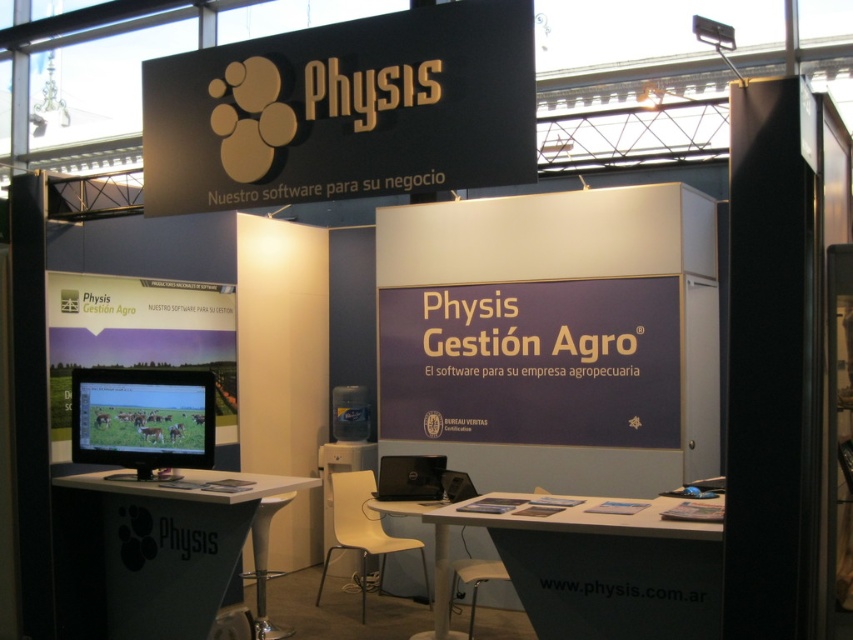
You are a visitor at the trade show and want to sit down to discuss the software with a representative. There is a white matte table at center and a white plastic stool at lower center. Which object should you approach to sit comfortably?

You should approach the white plastic stool at lower center because it is designed for sitting, while the white matte table at center is meant for placing items. Additionally, the distance between them is 5.36 feet, so you can easily reach the table while sitting on the stool.

You are a visitor at the trade show booth for Physis Gestione Agro. You notice the black matte sign at upper center and the metallic stool at center. Which object is wider?

The black matte sign at upper center is wider than the metallic stool at center.

You are setting up a presentation at the Physis Gestione Agro booth. You have a black plastic laptop at center that you need to place on the white matte table at center. Will the laptop fit on the table without overhanging the edges?

The white matte table at center has a larger width than the black plastic laptop at center, so the laptop will fit on the table without overhanging the edges.